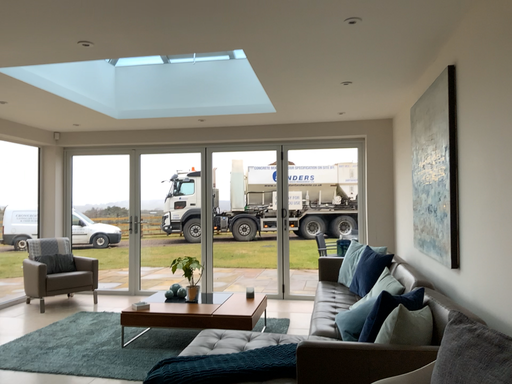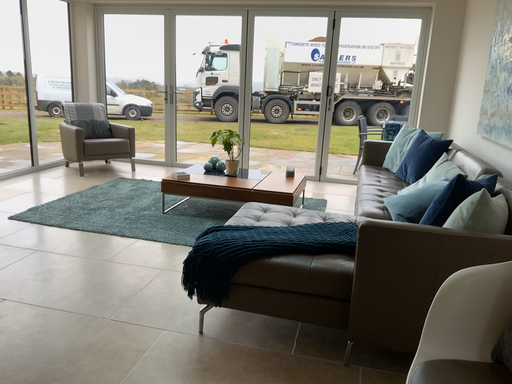
Question: Which way did the camera rotate in the video?

Choices:
 (A) rotated downward
 (B) rotated upward

Answer: (A)